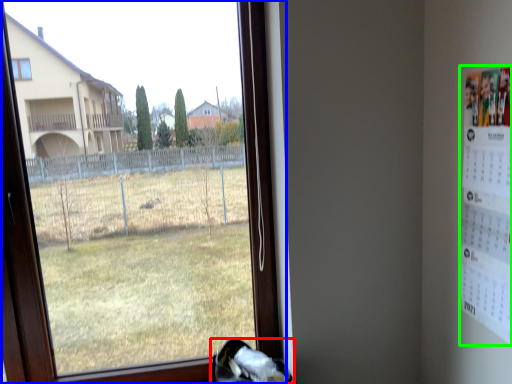
Question: Which object is the farthest from shoe (highlighted by a red box)? Choose among these: window (highlighted by a blue box) or poster (highlighted by a green box).

Choices:
 (A) window
 (B) poster

Answer: (A)